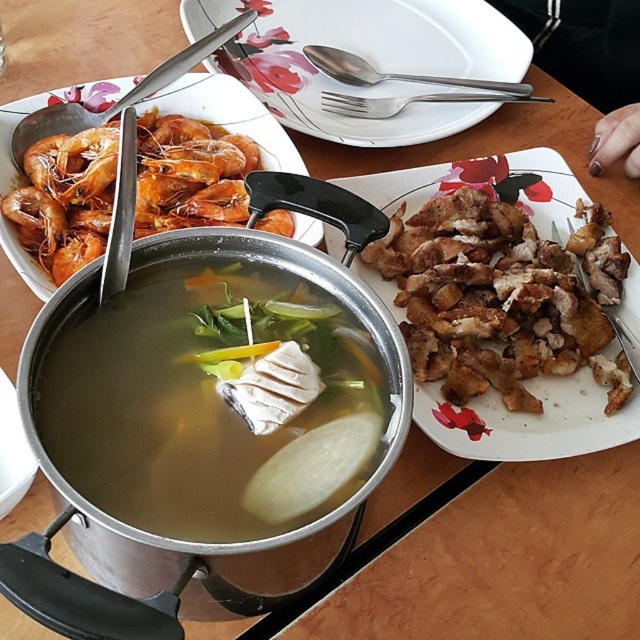
Is brown crispy chicken at right positioned before orange matte shrimp at left?

No, brown crispy chicken at right is further to the viewer.

Which is below, brown crispy chicken at right or orange matte shrimp at left?

brown crispy chicken at right is lower down.

Describe the element at coordinates (492, 301) in the screenshot. The image size is (640, 640). I see `brown crispy chicken at right` at that location.

Find the location of a particular element. The width and height of the screenshot is (640, 640). brown crispy chicken at right is located at coordinates (492, 301).

Which is more to the left, white glossy plate at upper center or satin silver spoon at upper center?

white glossy plate at upper center is more to the left.

Does white glossy plate at upper center have a greater height compared to satin silver spoon at upper center?

Yes, white glossy plate at upper center is taller than satin silver spoon at upper center.

The height and width of the screenshot is (640, 640). I want to click on white glossy plate at upper center, so click(368, 60).

Does point (445, 328) come behind point (460, 74)?

That is False.

The image size is (640, 640). I want to click on brown crispy chicken at right, so click(x=492, y=301).